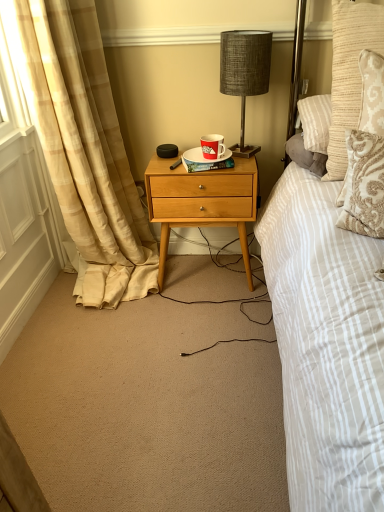
Locate an element on the screen. This screenshot has height=512, width=384. free space to the right of white glossy plate at center is located at coordinates (240, 155).